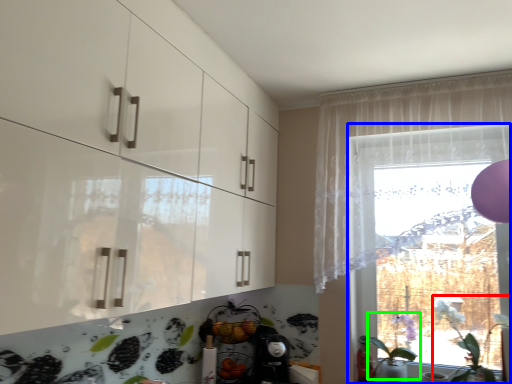
Question: Which object is the farthest from plant (highlighted by a red box)? Choose among these: window (highlighted by a blue box) or plant (highlighted by a green box).

Choices:
 (A) window
 (B) plant

Answer: (A)